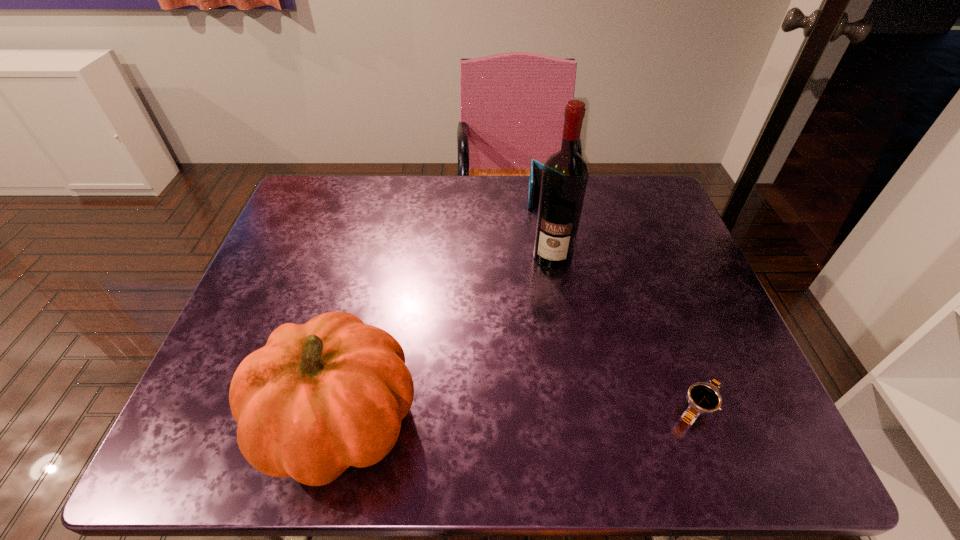
This screenshot has width=960, height=540. In order to click on object that is at the right edge in this screenshot , I will do `click(703, 397)`.

Image resolution: width=960 pixels, height=540 pixels. In order to click on object that is at the near left corner in this screenshot , I will do pos(319,397).

You are a GUI agent. You are given a task and a screenshot of the screen. Output one action in this format:
    pyautogui.click(x=<x>, y=<y>)
    Task: Click on the object present at the near right corner
    
    Given the screenshot: What is the action you would take?
    pyautogui.click(x=703, y=397)

This screenshot has width=960, height=540. Identify the location of free location at the far edge of the desktop. (364, 185).

The width and height of the screenshot is (960, 540). In the image, there is a desktop. Identify the location of free space at the left edge. (234, 359).

Find the location of a particular element. The image size is (960, 540). free space at the right edge of the desktop is located at coordinates (676, 238).

Image resolution: width=960 pixels, height=540 pixels. Find the location of `vacant space at the far left corner of the desktop`. vacant space at the far left corner of the desktop is located at coordinates (349, 186).

The image size is (960, 540). Find the location of `vacant space at the far right corner`. vacant space at the far right corner is located at coordinates (640, 191).

Find the location of a particular element. free space that is in between the watch and the second shortest object is located at coordinates (620, 303).

In order to click on vacant space in between the pumpkin and the second shortest object in this screenshot , I will do `click(442, 309)`.